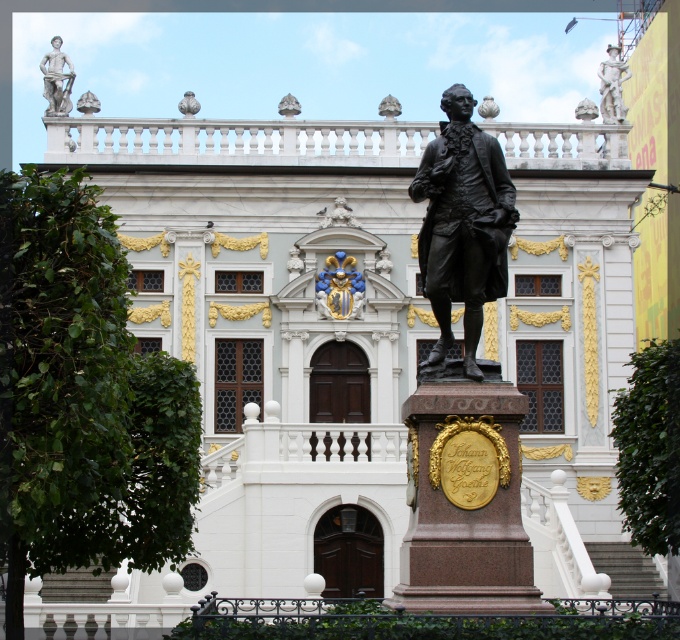
You are standing in front of the grand ornate building and want to take a photo of the bronze statue of a man dressed in 18th century attire holding a book or scroll. The statue is located at point (430, 186). If your camera has a focal length of 50mm and you want to capture the statue in the frame, what is the minimum distance you should be from the statue to ensure it fits within the camera sensor which has a diagonal of 36mm?

The distance of point (430, 186) from viewer is 52.97 meters. To calculate the minimum distance needed, use the formula distance < sensor diagonal x focal length. Here, 36mm x 50mm equals 1800mm, so 1.8 meters. Since the statue is 52.97 meters away, which is much greater than 1.8 meters, you can move closer to ensure it fits within the frame.

You are standing in front of the grand ornate building. Where is the bronze statue at center relative to the building?

Answer: The bronze statue at center is located at point 0.352 meters to the left and 0.681 meters in front of the building.